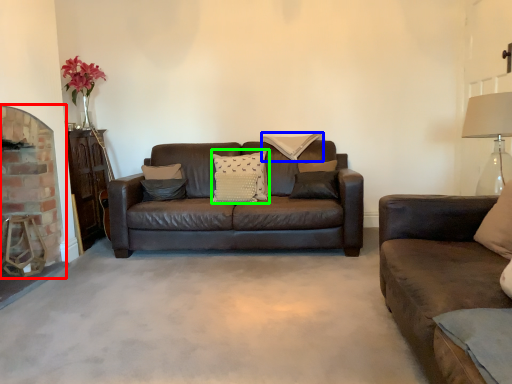
Question: Which object is positioned farthest from fireplace (highlighted by a red box)? Select from pillow (highlighted by a blue box) and pillow (highlighted by a green box).

Choices:
 (A) pillow
 (B) pillow

Answer: (A)